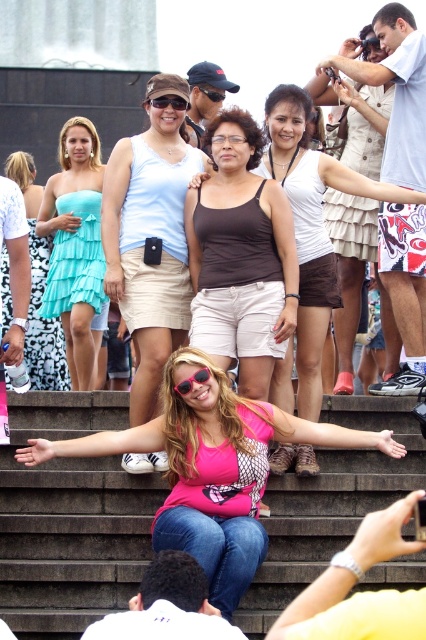
Question: Can you confirm if light beige skirt at center is positioned to the left of teal ruffled dress at upper left?

Choices:
 (A) no
 (B) yes

Answer: (A)

Question: Which object appears farthest from the camera in this image?

Choices:
 (A) teal satin dress at upper left
 (B) black plastic goggles at center
 (C) light beige skirt at center
 (D) brown cotton tank top at center

Answer: (B)

Question: Considering the relative positions of concrete stairs at center and teal satin dress at upper left in the image provided, where is concrete stairs at center located with respect to teal satin dress at upper left?

Choices:
 (A) left
 (B) right

Answer: (B)

Question: Which of the following is the closest to the observer?

Choices:
 (A) pink matte sunglasses at center
 (B) brown tank top at center

Answer: (A)

Question: Is brown tank top at center thinner than black plastic goggles at center?

Choices:
 (A) yes
 (B) no

Answer: (B)

Question: Estimate the real-world distances between objects in this image. Which object is farther from the black matte sunglasses at center?

Choices:
 (A) concrete stairs at center
 (B) brown tank top at center
 (C) pink matte sunglasses at center

Answer: (A)